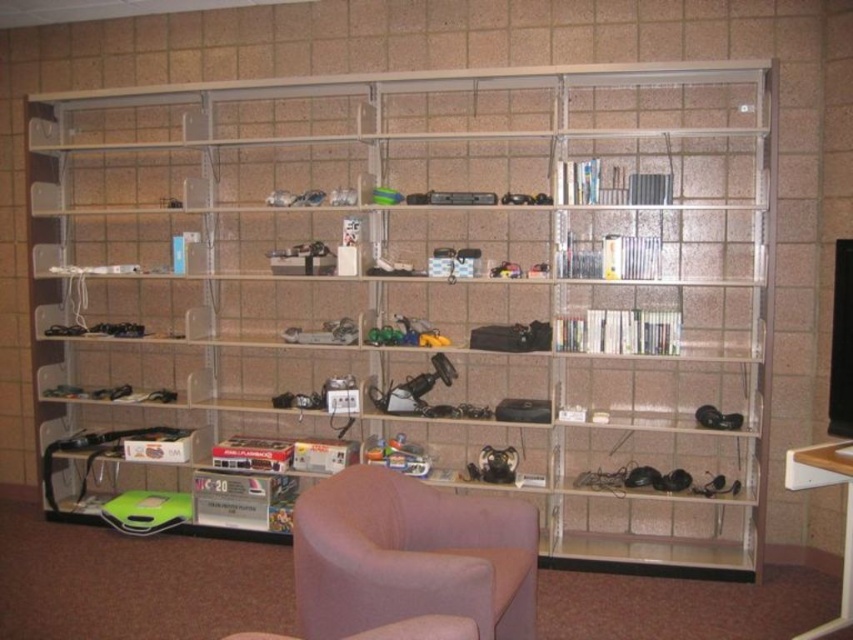
Does clear plastic bookcase at center have a greater width compared to pink fabric swivel chair at lower center?

Yes, clear plastic bookcase at center is wider than pink fabric swivel chair at lower center.

Who is more forward, [195,496] or [341,630]?

Point [341,630]

You are a GUI agent. You are given a task and a screenshot of the screen. Output one action in this format:
    pyautogui.click(x=<x>, y=<y>)
    Task: Click on the clear plastic bookcase at center
    This screenshot has width=853, height=640.
    Given the screenshot: What is the action you would take?
    pyautogui.click(x=426, y=284)